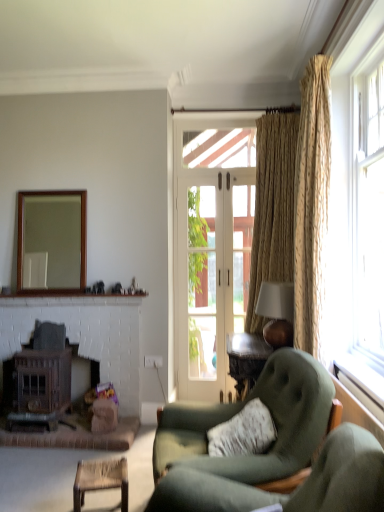
Where is `free spot above dark brown wood fireplace at lower left (from a real-world perspective)`? This screenshot has height=512, width=384. free spot above dark brown wood fireplace at lower left (from a real-world perspective) is located at coordinates (73, 311).